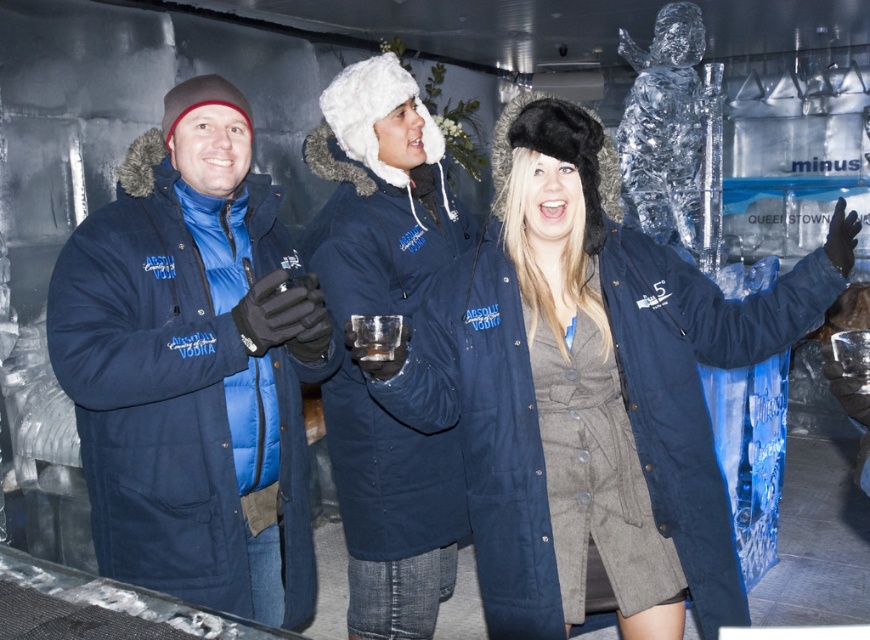
You are organizing a photo shoot inside the icy structure and need to arrange the matte blue coat at left and navy blue parka at center for a group shot. Since space is limited, which of the two garments should you prioritize placing first to ensure both fit comfortably?

The matte blue coat at left occupies less space than the navy blue parkak at center, so you should prioritize placing the navy blue parka at center first to ensure both fit comfortably.